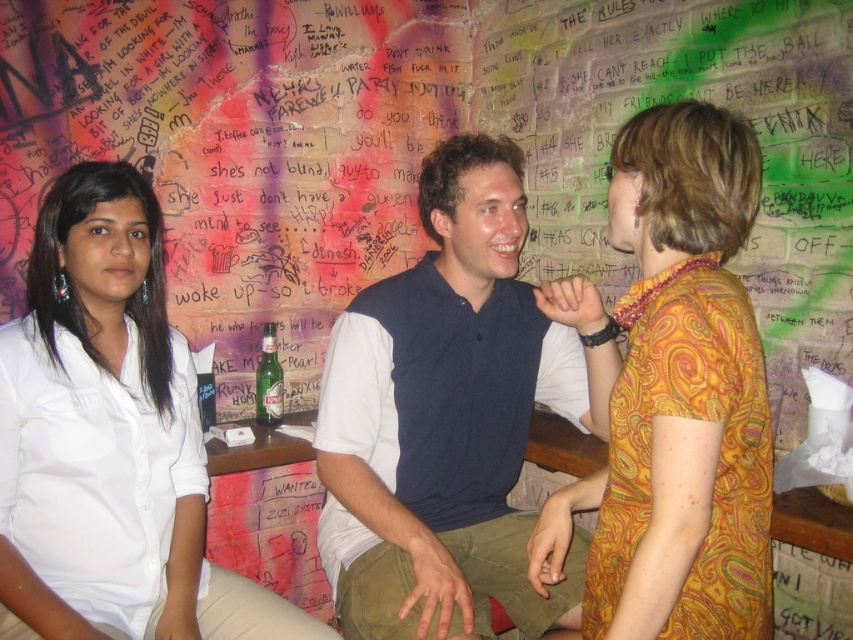
You are a photographer setting up a shoot in front of a graffiti wall. You have two subjects wearing a white smooth shirt at left and a yellow paisley dress at center. To ensure both are centered in the frame, which subject should you position closer to the middle of the camera view?

The yellow paisley dress at center is already positioned at the center, so you should keep it there. The white smooth shirt at left is to the left of the yellow paisley dress at center, so move it closer to the middle by shifting it towards the dress.

You are standing in front of the graffiti wall and see the yellow paisley dress at center. Can you estimate its location using coordinates?

The yellow paisley dress at center is located at coordinates point (677, 397).